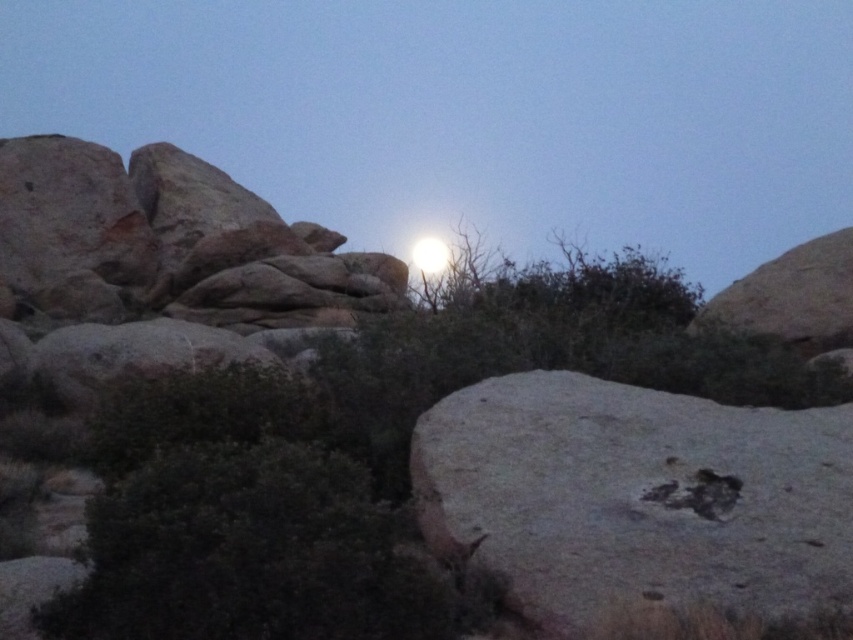
Question: Among these objects, which one is farthest from the camera?

Choices:
 (A) gray rough rock at center
 (B) bright white sphere at upper center

Answer: (B)

Question: Which object is closer to the camera taking this photo?

Choices:
 (A) bright white sphere at upper center
 (B) gray rough rock at center

Answer: (B)

Question: Does smooth rock at center appear over gray rough rock at center?

Choices:
 (A) yes
 (B) no

Answer: (A)

Question: Which point is farther to the camera?

Choices:
 (A) bright white sphere at upper center
 (B) smooth rock at center
 (C) gray rough rock at center

Answer: (B)

Question: Can you confirm if gray rough rock at center is positioned below bright white sphere at upper center?

Choices:
 (A) yes
 (B) no

Answer: (A)

Question: Observing the image, what is the correct spatial positioning of gray rough rock at center in reference to bright white sphere at upper center?

Choices:
 (A) left
 (B) right

Answer: (B)